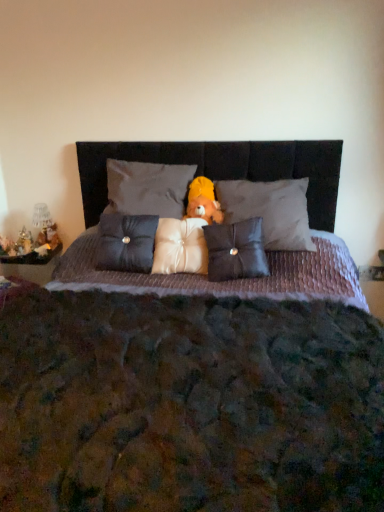
Question: Is metallic gold figurine at left, the first figurine from the right, at the right side of matte black pillow at center, which is counted as the 2th pillow, starting from the right?

Choices:
 (A) no
 (B) yes

Answer: (A)

Question: Is matte black pillow at center, which is counted as the 2th pillow, starting from the right, at the back of metallic gold figurine at left, the first figurine from the right?

Choices:
 (A) yes
 (B) no

Answer: (B)

Question: Considering the relative sizes of metallic gold figurine at left, the first figurine from the right, and matte black pillow at center, marked as the 4th pillow in a left-to-right arrangement, in the image provided, is metallic gold figurine at left, the first figurine from the right, smaller than matte black pillow at center, marked as the 4th pillow in a left-to-right arrangement,?

Choices:
 (A) no
 (B) yes

Answer: (B)

Question: Considering the relative sizes of metallic gold figurine at left, the first figurine from the right, and matte black pillow at center, marked as the 4th pillow in a left-to-right arrangement, in the image provided, is metallic gold figurine at left, the first figurine from the right, thinner than matte black pillow at center, marked as the 4th pillow in a left-to-right arrangement,?

Choices:
 (A) no
 (B) yes

Answer: (B)

Question: Does metallic gold figurine at left, which ranks as the second figurine in left-to-right order, come in front of matte black pillow at center, which is counted as the 2th pillow, starting from the right?

Choices:
 (A) no
 (B) yes

Answer: (A)

Question: Considering the relative positions of yellow plush bear at center and textured purple quilt at center in the image provided, is yellow plush bear at center to the left or to the right of textured purple quilt at center?

Choices:
 (A) left
 (B) right

Answer: (B)

Question: Relative to textured purple quilt at center, is yellow plush bear at center in front or behind?

Choices:
 (A) front
 (B) behind

Answer: (B)

Question: Is yellow plush bear at center inside the boundaries of textured purple quilt at center, or outside?

Choices:
 (A) inside
 (B) outside

Answer: (A)

Question: From a real-world perspective, is yellow plush bear at center above or below textured purple quilt at center?

Choices:
 (A) above
 (B) below

Answer: (A)

Question: Looking at the image, does matte gray pillow at center, the second pillow in the left-to-right sequence, seem bigger or smaller compared to matte gray pillow at center, marked as the 1th pillow in a right-to-left arrangement?

Choices:
 (A) small
 (B) big

Answer: (A)

Question: Is matte gray pillow at center, which is counted as the fourth pillow, starting from the right, inside or outside of matte gray pillow at center, acting as the 5th pillow starting from the left?

Choices:
 (A) outside
 (B) inside

Answer: (A)

Question: Would you say matte gray pillow at center, the second pillow in the left-to-right sequence, is to the left or to the right of matte gray pillow at center, acting as the 5th pillow starting from the left, in the picture?

Choices:
 (A) left
 (B) right

Answer: (A)

Question: In the image, is matte gray pillow at center, the second pillow in the left-to-right sequence, positioned in front of or behind matte gray pillow at center, marked as the 1th pillow in a right-to-left arrangement?

Choices:
 (A) behind
 (B) front

Answer: (A)

Question: From a real-world perspective, relative to satin dark blue pillow at center, marked as the fifth pillow in a right-to-left arrangement, is satin white pillow at center, the third pillow from the right, vertically above or below?

Choices:
 (A) above
 (B) below

Answer: (B)

Question: Considering the positions of satin white pillow at center, the third pillow from the right, and satin dark blue pillow at center, marked as the fifth pillow in a right-to-left arrangement, in the image, is satin white pillow at center, the third pillow from the right, wider or thinner than satin dark blue pillow at center, marked as the fifth pillow in a right-to-left arrangement,?

Choices:
 (A) wide
 (B) thin

Answer: (A)